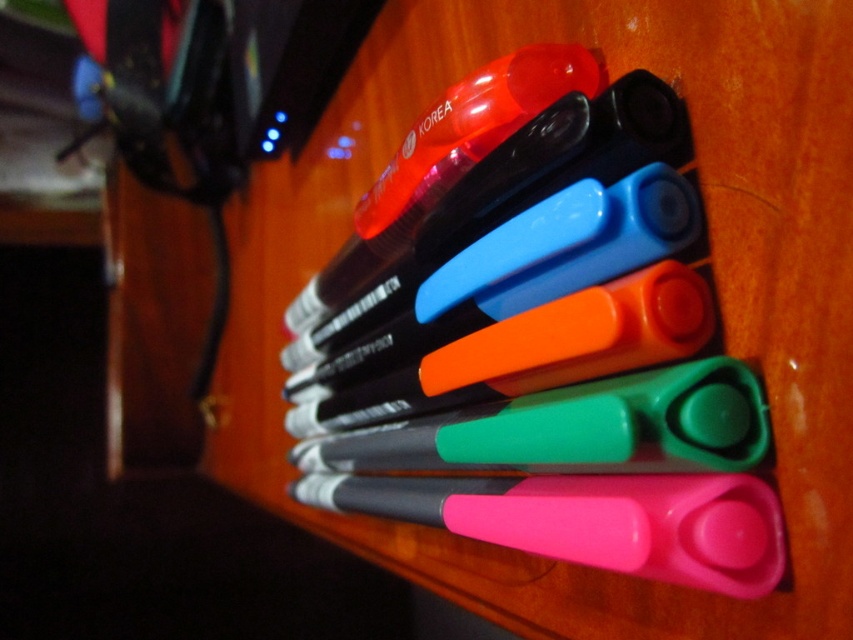
You are organizing a craft station and need to place the pink plastic scissors at center. Where exactly should you place them?

You should place the pink plastic scissors at center at point (590,520).

You have a small box that can only fit items narrower than the green plastic scissors at center. Can the translucent plastic highlighter at upper center fit into the box?

The translucent plastic highlighter at upper center is wider than the green plastic scissors at center, so it cannot fit into the box designed for items narrower than the scissors.

From the picture: You are organizing a desk and need to place the translucent plastic highlighter at upper center and the pink plastic scissors at center. According to the image, which object is positioned to the right?

The pink plastic scissors at center are positioned to the right of the translucent plastic highlighter at upper center.